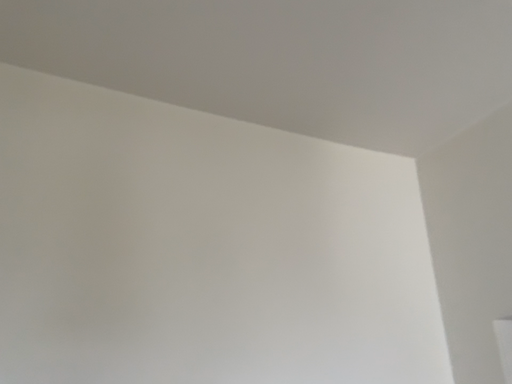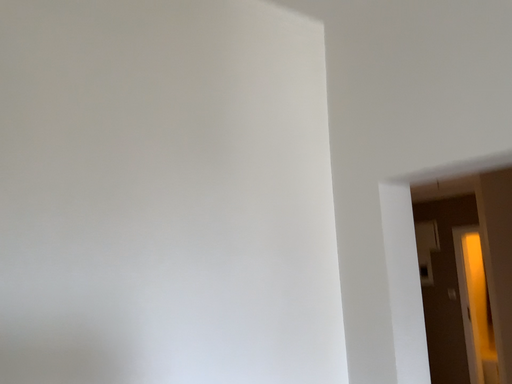
Question: Which way did the camera rotate in the video?

Choices:
 (A) rotated upward
 (B) rotated downward

Answer: (B)